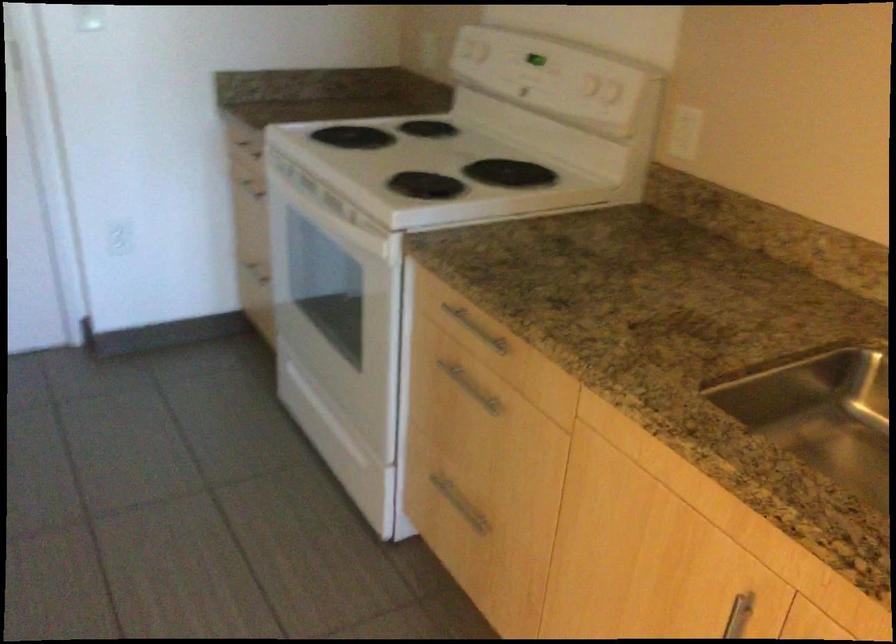
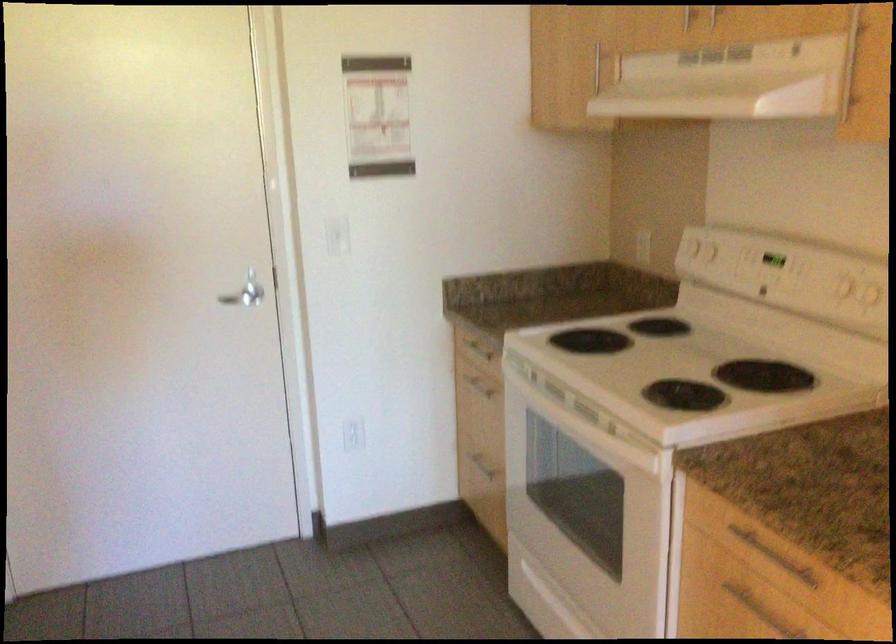
In the second image, find the point that corresponds to point (255, 272) in the first image.

(478, 462)